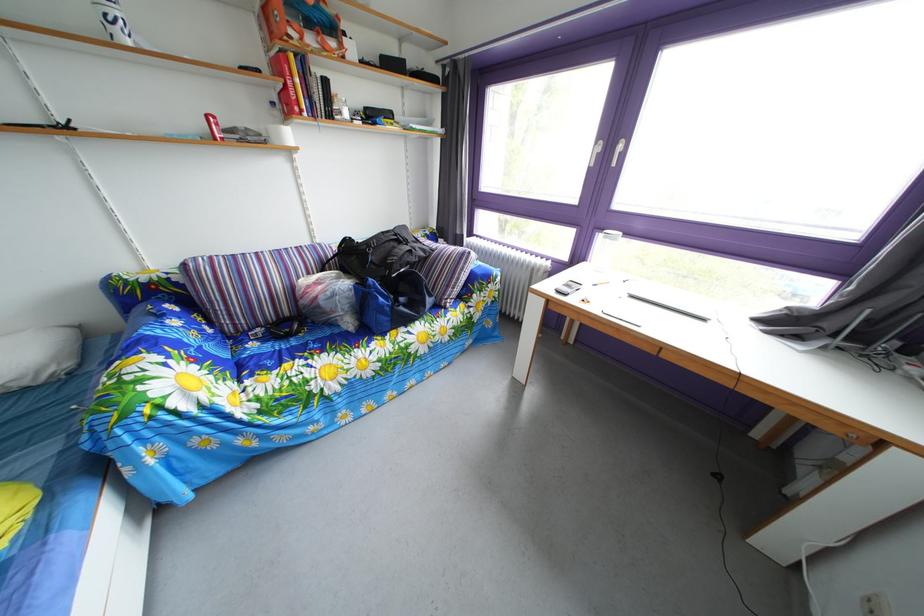
Find the location of a particular element. The height and width of the screenshot is (616, 924). red book is located at coordinates (286, 84).